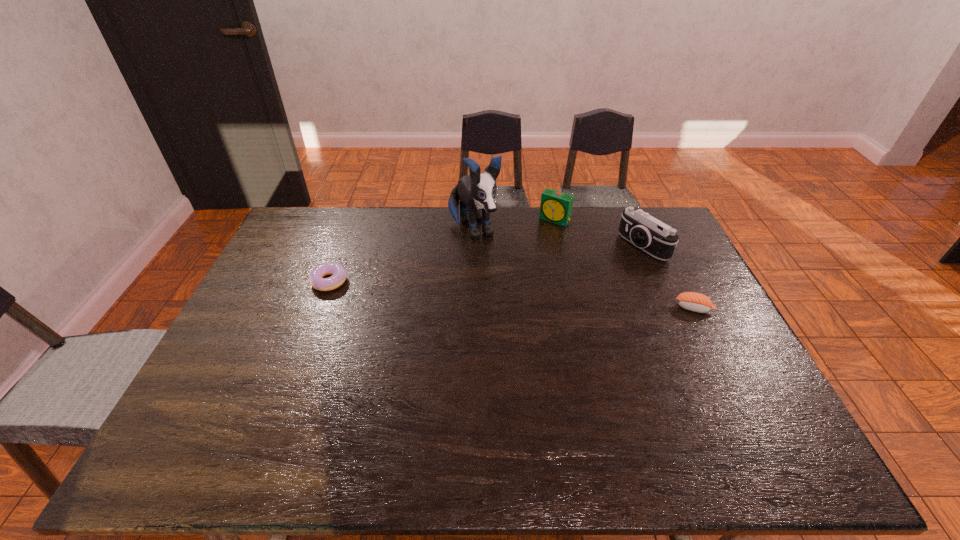
The image size is (960, 540). I want to click on unoccupied position between the shortest object and the camera, so click(x=486, y=264).

You are a GUI agent. You are given a task and a screenshot of the screen. Output one action in this format:
    pyautogui.click(x=<x>, y=<y>)
    Task: Click on the unoccupied area between the second nearest object and the camera
    The height and width of the screenshot is (540, 960).
    Given the screenshot: What is the action you would take?
    pyautogui.click(x=486, y=264)

This screenshot has height=540, width=960. I want to click on object that stands as the second closest to the shortest object, so click(555, 206).

Locate which object is the closest to the camera. Please provide its 2D coordinates. Your answer should be formatted as a tuple, i.e. [(x, y)], where the tuple contains the x and y coordinates of a point satisfying the conditions above.

[(555, 206)]

Identify the location of free space that satisfies the following two spatial constraints: 1. on the front side of the alarm clock; 2. on the right side of the camera. (561, 246).

Where is `free spot that satisfies the following two spatial constraints: 1. on the back side of the fourth object from right to left; 2. on the right side of the third tallest object`? free spot that satisfies the following two spatial constraints: 1. on the back side of the fourth object from right to left; 2. on the right side of the third tallest object is located at coordinates (473, 219).

Where is `vacant space that satisfies the following two spatial constraints: 1. on the back side of the tallest object; 2. on the right side of the doughnut`? The image size is (960, 540). vacant space that satisfies the following two spatial constraints: 1. on the back side of the tallest object; 2. on the right side of the doughnut is located at coordinates (348, 230).